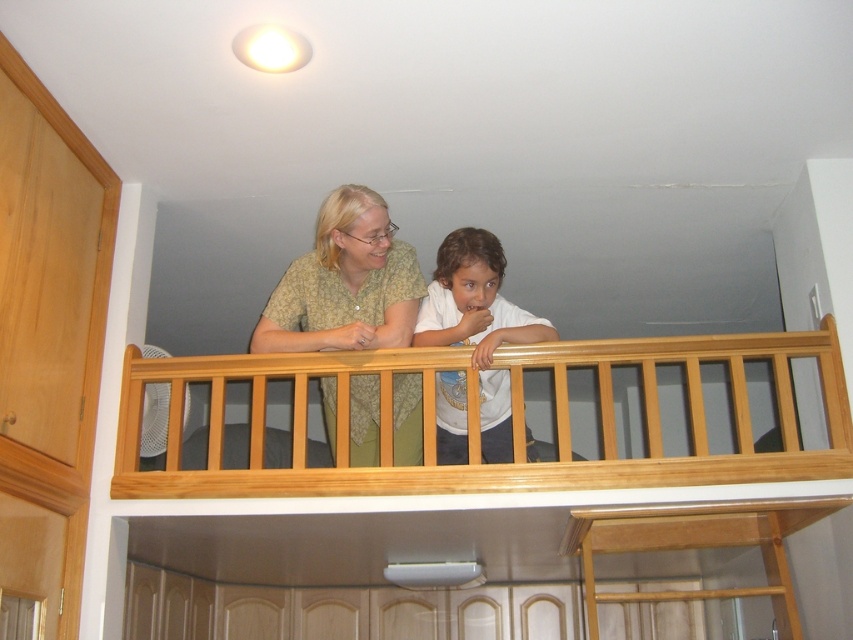
You are a painter who needs to hang a picture frame that requires a hook at least 1.5 meters high. You see the light brown wood at upper center and the green matte shirt at upper center in the scene. Which object can you safely assume is tall enough to reach the required height for the hook?

The green matte shirt at upper center is taller than the light brown wood at upper center, so the hook can be safely placed on the green matte shirt at upper center to meet the height requirement.

You are a drone operator who needs to fly a drone between the green matte shirt at upper center and the white matte shirt at center. The drone has a wingspan of 10 inches. Can the drone safely pass between them?

The green matte shirt at upper center and white matte shirt at center are 10.60 inches apart from each other. Since the drone has a wingspan of 10 inches, which is less than the 10.60 inches gap, the drone can safely pass between them.

You are standing on the loft railing and want to place a small plant pot exactly at the point marked by coordinates point (x=477, y=419). What color wood will the pot be placed on?

The point (x=477, y=419) is marked as light brown wood at upper center, so the pot will be placed on light brown wood.